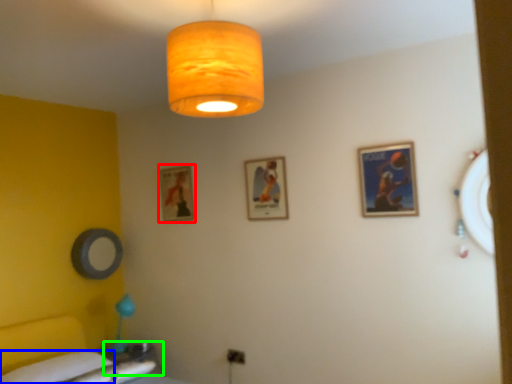
Question: Which object is positioned farthest from picture frame (highlighted by a red box)? Select from sheet (highlighted by a blue box) and table (highlighted by a green box).

Choices:
 (A) sheet
 (B) table

Answer: (A)